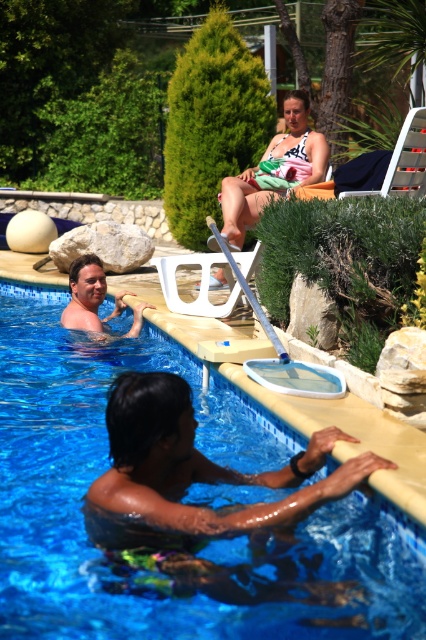
Question: Can you confirm if blue glossy swimming pool at center is bigger than matte pink bikini top at upper center?

Choices:
 (A) no
 (B) yes

Answer: (A)

Question: Which object appears farthest from the camera in this image?

Choices:
 (A) smooth skin man at left
 (B) matte pink bikini top at upper center
 (C) blue glossy swimming pool at center

Answer: (B)

Question: Which of the following is the farthest from the observer?

Choices:
 (A) (301, 113)
 (B) (92, 280)

Answer: (A)

Question: Can you confirm if blue glossy swimming pool at center is positioned above matte pink bikini top at upper center?

Choices:
 (A) yes
 (B) no

Answer: (B)

Question: Which object appears closest to the camera in this image?

Choices:
 (A) matte pink bikini top at upper center
 (B) blue glossy swimming pool at center
 (C) smooth skin man at left

Answer: (B)

Question: Is matte pink bikini top at upper center below smooth skin man at left?

Choices:
 (A) yes
 (B) no

Answer: (B)